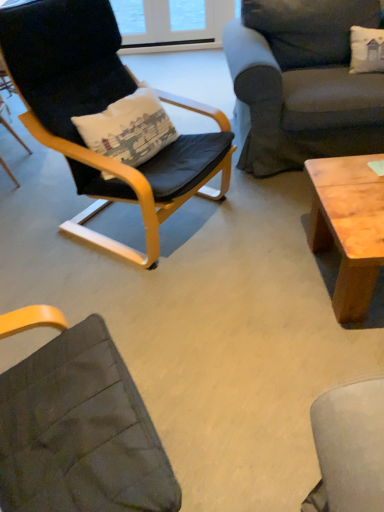
At what (x,y) coordinates should I click in order to perform the action: click on empty space that is ontop of natural wood coffee table at right. Please return your answer as a coordinate pair (x, y). The width and height of the screenshot is (384, 512). Looking at the image, I should click on (360, 199).